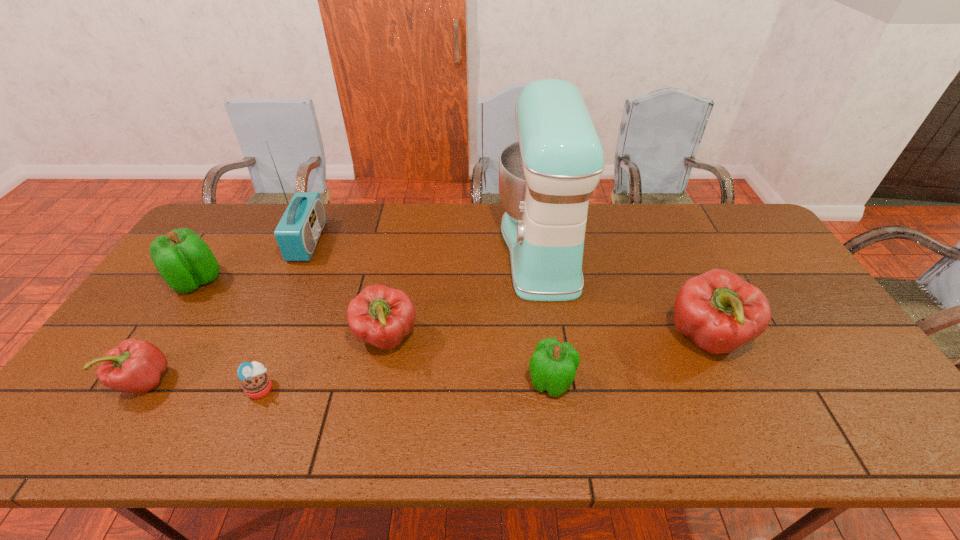
Where is `the nearer green bell pepper`? The height and width of the screenshot is (540, 960). the nearer green bell pepper is located at coordinates (553, 365).

You are a GUI agent. You are given a task and a screenshot of the screen. Output one action in this format:
    pyautogui.click(x=<x>, y=<y>)
    Task: Click on the smaller green bell pepper
    
    Given the screenshot: What is the action you would take?
    pyautogui.click(x=553, y=365)

Locate an element on the screen. Image resolution: width=960 pixels, height=540 pixels. the smallest pink bell pepper is located at coordinates (135, 366).

At what (x,y) coordinates should I click in order to perform the action: click on pink muffin. Please return your answer as a coordinate pair (x, y). Looking at the image, I should click on (256, 383).

Where is `the shortest object`? This screenshot has width=960, height=540. the shortest object is located at coordinates (256, 383).

Locate an element on the screen. The image size is (960, 540). free location located 0.120m at the base of the mixer is located at coordinates (461, 248).

I want to click on free spot located 0.160m at the base of the mixer, so click(448, 248).

Find the location of a particular element. vacant space located at the base of the mixer is located at coordinates (403, 248).

What are the coordinates of `free location located on the front panel of the radio receiver` in the screenshot? It's located at (399, 241).

Locate an element on the screen. The image size is (960, 540). free spot located on the left of the rightmost bell pepper is located at coordinates (581, 339).